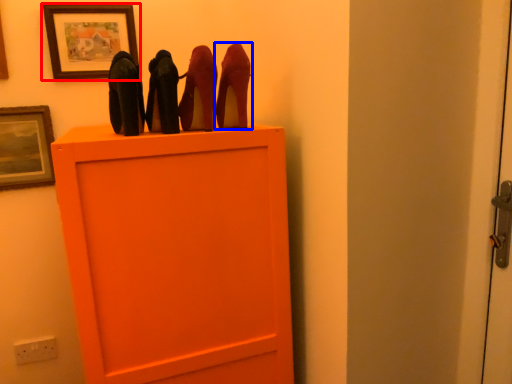
Question: Which object is further to the camera taking this photo, picture frame (highlighted by a red box) or high heels (highlighted by a blue box)?

Choices:
 (A) picture frame
 (B) high heels

Answer: (A)